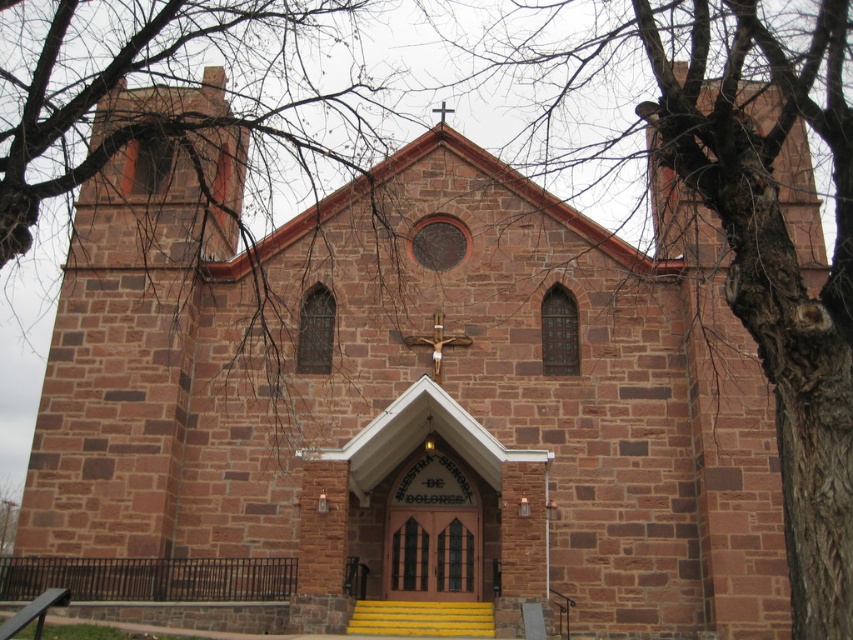
In the scene shown: Who is positioned more to the left, bark textured tree at upper center or yellow painted wood stairs at center?

yellow painted wood stairs at center

At what (x,y) coordinates should I click in order to perform the action: click on bark textured tree at upper center. Please return your answer as a coordinate pair (x, y). This screenshot has width=853, height=640. Looking at the image, I should click on (751, 230).

Which of these two, bare branches at center or yellow painted wood stairs at center, stands shorter?

yellow painted wood stairs at center is shorter.

Describe the element at coordinates (189, 109) in the screenshot. I see `bare branches at center` at that location.

Locate an element on the screen. This screenshot has width=853, height=640. bare branches at center is located at coordinates (189, 109).

Which of these two, bare branches at center or bark textured tree at upper center, stands shorter?

bark textured tree at upper center is shorter.

Is bare branches at center bigger than bark textured tree at upper center?

Yes.

The height and width of the screenshot is (640, 853). I want to click on bare branches at center, so click(x=189, y=109).

Locate an element on the screen. Image resolution: width=853 pixels, height=640 pixels. bare branches at center is located at coordinates (189, 109).